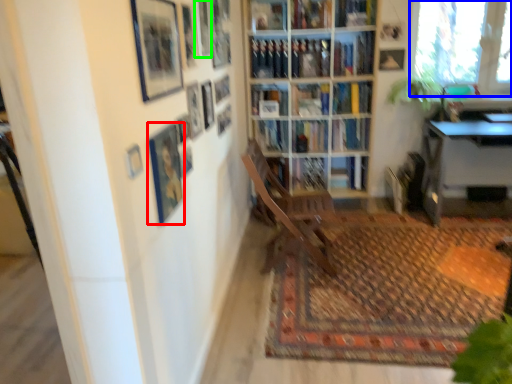
Question: Considering the real-world distances, which object is farthest from picture frame (highlighted by a red box)? window (highlighted by a blue box) or picture frame (highlighted by a green box)?

Choices:
 (A) window
 (B) picture frame

Answer: (A)